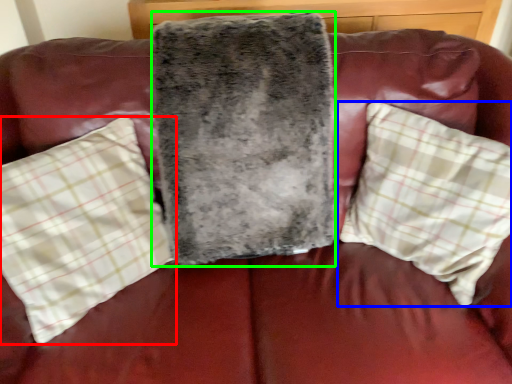
Question: Which object is the farthest from pillow (highlighted by a red box)? Choose among these: pillow (highlighted by a blue box) or blanket (highlighted by a green box).

Choices:
 (A) pillow
 (B) blanket

Answer: (A)